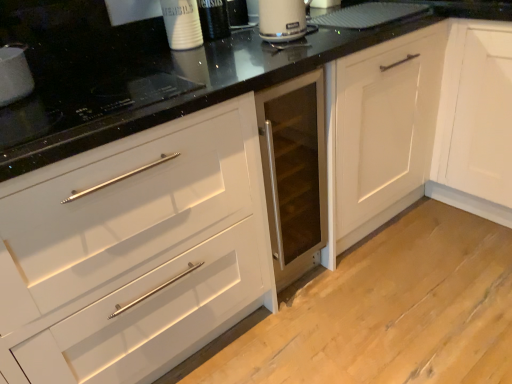
Question: Considering the relative sizes of matte black induction cooktop at upper left, placed as the first appliance when sorted from left to right, and matte white kettle at upper center in the image provided, is matte black induction cooktop at upper left, placed as the first appliance when sorted from left to right, bigger than matte white kettle at upper center?

Choices:
 (A) yes
 (B) no

Answer: (B)

Question: Is matte black induction cooktop at upper left, marked as the second appliance in a right-to-left arrangement, not within matte white kettle at upper center?

Choices:
 (A) yes
 (B) no

Answer: (A)

Question: Is matte black induction cooktop at upper left, marked as the second appliance in a right-to-left arrangement, oriented away from matte white kettle at upper center?

Choices:
 (A) no
 (B) yes

Answer: (A)

Question: Considering the relative positions of matte black induction cooktop at upper left, marked as the second appliance in a right-to-left arrangement, and matte white kettle at upper center in the image provided, is matte black induction cooktop at upper left, marked as the second appliance in a right-to-left arrangement, to the right of matte white kettle at upper center from the viewer's perspective?

Choices:
 (A) yes
 (B) no

Answer: (B)

Question: Does matte black induction cooktop at upper left, marked as the second appliance in a right-to-left arrangement, appear on the left side of matte white kettle at upper center?

Choices:
 (A) yes
 (B) no

Answer: (A)

Question: Does matte black induction cooktop at upper left, marked as the second appliance in a right-to-left arrangement, turn towards matte white kettle at upper center?

Choices:
 (A) no
 (B) yes

Answer: (A)

Question: From the image's perspective, would you say matte white kettle at upper center is positioned over matte black induction cooktop at upper left, marked as the second appliance in a right-to-left arrangement?

Choices:
 (A) yes
 (B) no

Answer: (A)

Question: Does matte white kettle at upper center have a lesser height compared to matte black induction cooktop at upper left, marked as the second appliance in a right-to-left arrangement?

Choices:
 (A) yes
 (B) no

Answer: (B)

Question: Is matte white kettle at upper center positioned behind matte black induction cooktop at upper left, placed as the first appliance when sorted from left to right?

Choices:
 (A) yes
 (B) no

Answer: (A)

Question: Would you consider matte white kettle at upper center to be distant from matte black induction cooktop at upper left, marked as the second appliance in a right-to-left arrangement?

Choices:
 (A) yes
 (B) no

Answer: (B)

Question: From the image's perspective, is matte white kettle at upper center under matte black induction cooktop at upper left, placed as the first appliance when sorted from left to right?

Choices:
 (A) no
 (B) yes

Answer: (A)

Question: Can you confirm if matte white kettle at upper center is smaller than matte black induction cooktop at upper left, placed as the first appliance when sorted from left to right?

Choices:
 (A) no
 (B) yes

Answer: (A)

Question: Considering the relative sizes of white matte cabinet at center and black glass cooktop at upper left, which appears as the first appliance when viewed from the right, in the image provided, is white matte cabinet at center taller than black glass cooktop at upper left, which appears as the first appliance when viewed from the right,?

Choices:
 (A) no
 (B) yes

Answer: (B)